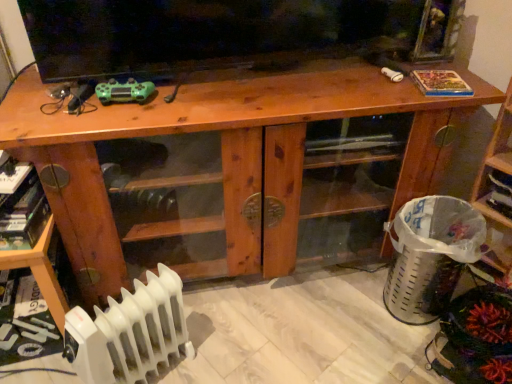
I want to click on vacant region to the left of green matte controller at upper left, so click(48, 109).